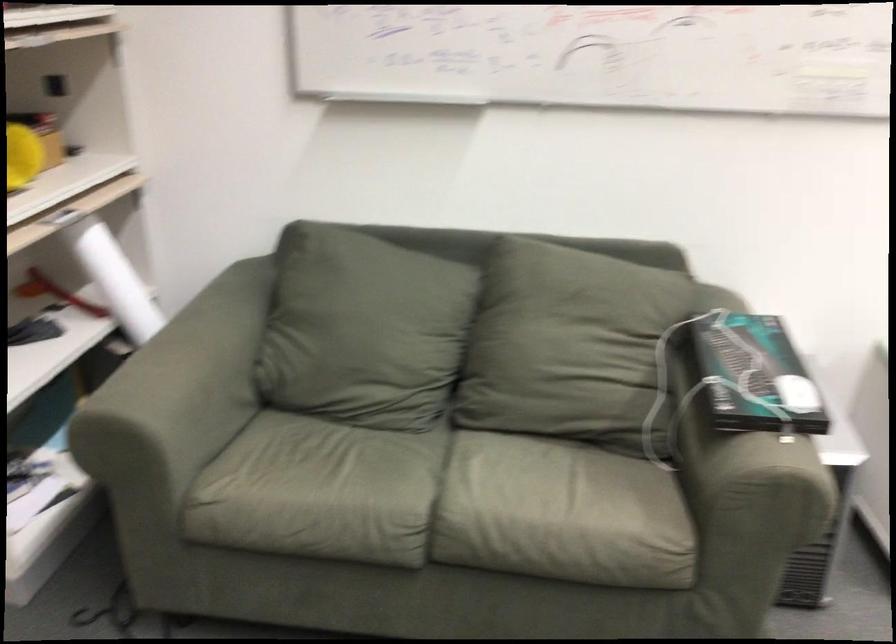
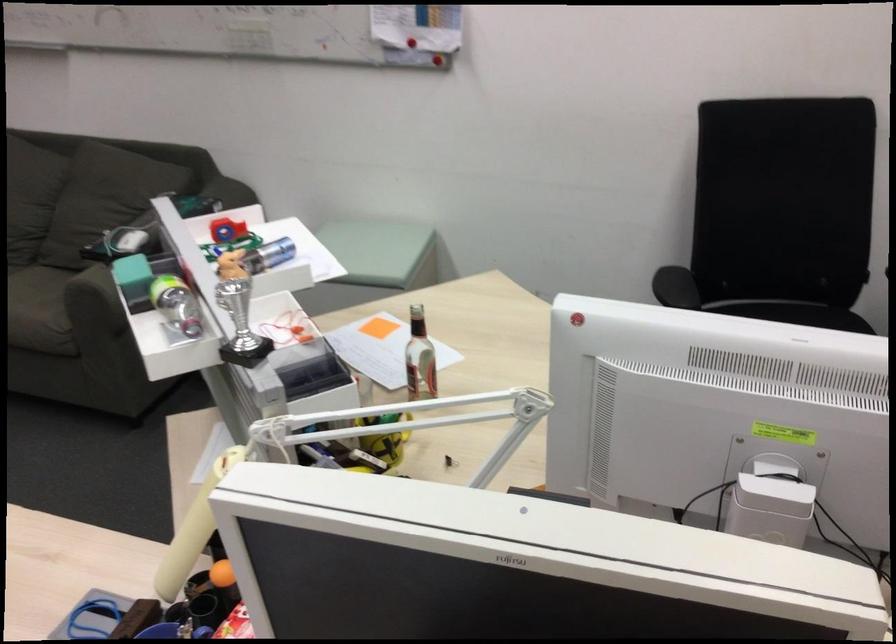
Where in the second image is the point corresponding to (x=513, y=502) from the first image?

(39, 308)